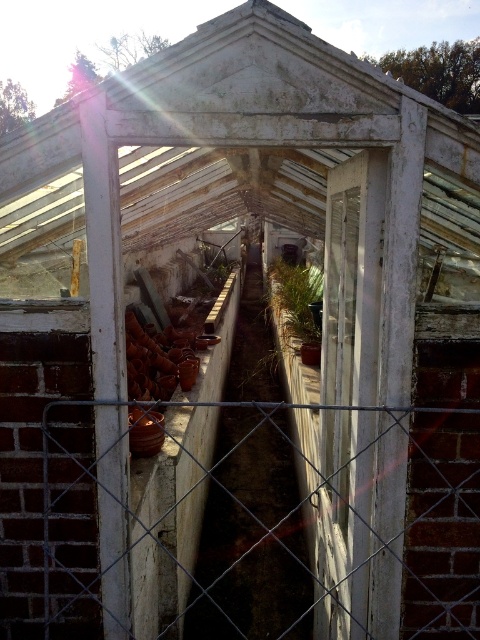
Question: Which point is closer to the camera?

Choices:
 (A) (456, 412)
 (B) (277, 298)

Answer: (A)

Question: Which point is farther to the camera?

Choices:
 (A) (305, 333)
 (B) (451, 408)

Answer: (A)

Question: Is metal mesh fence at center bigger than green matte plant at center?

Choices:
 (A) yes
 (B) no

Answer: (B)

Question: Does metal mesh fence at center appear over green matte plant at center?

Choices:
 (A) no
 (B) yes

Answer: (A)

Question: Where is metal mesh fence at center located in relation to green matte plant at center in the image?

Choices:
 (A) above
 (B) below

Answer: (B)

Question: Which object appears farthest from the camera in this image?

Choices:
 (A) green matte plant at center
 (B) metal mesh fence at center

Answer: (A)